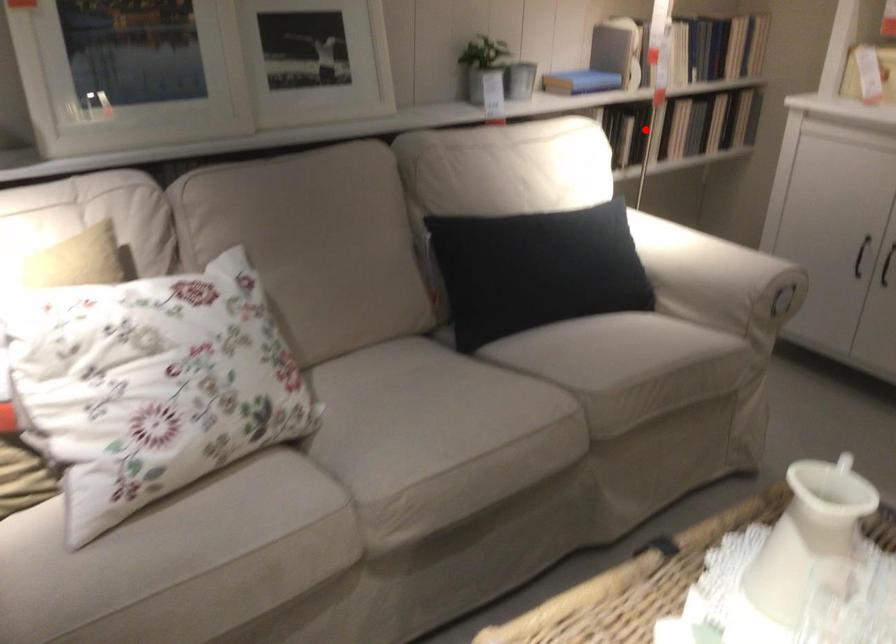
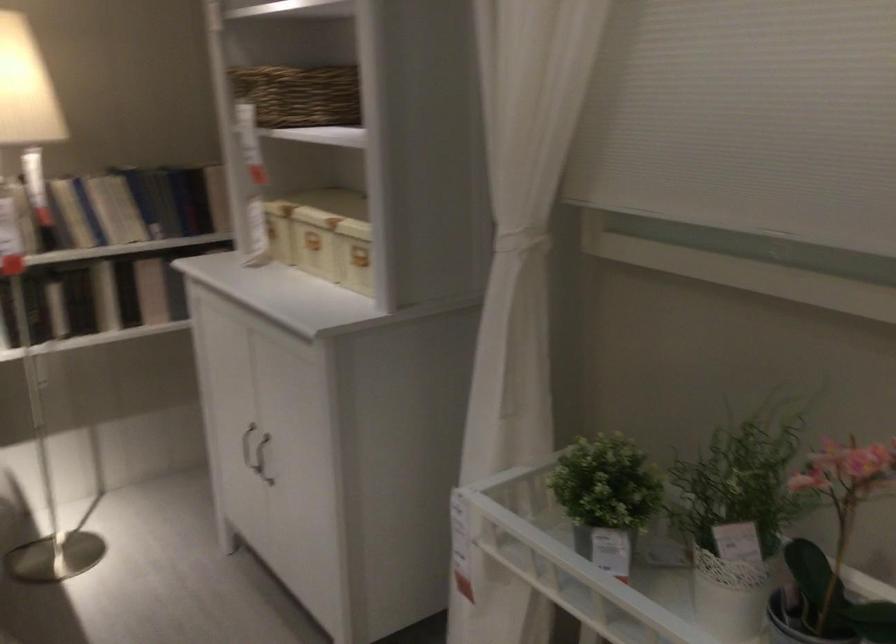
Question: I am providing you with two images of the same scene from different viewpoints. In image1, a red point is highlighted. Considering the same 3D point in image2, which of the following is correct?

Choices:
 (A) It is closer
 (B) It is farther

Answer: (A)